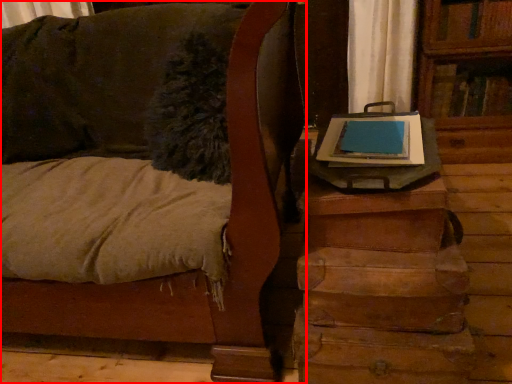
Question: In this image, where is furniture (annotated by the red box) located relative to table?

Choices:
 (A) right
 (B) left

Answer: (B)